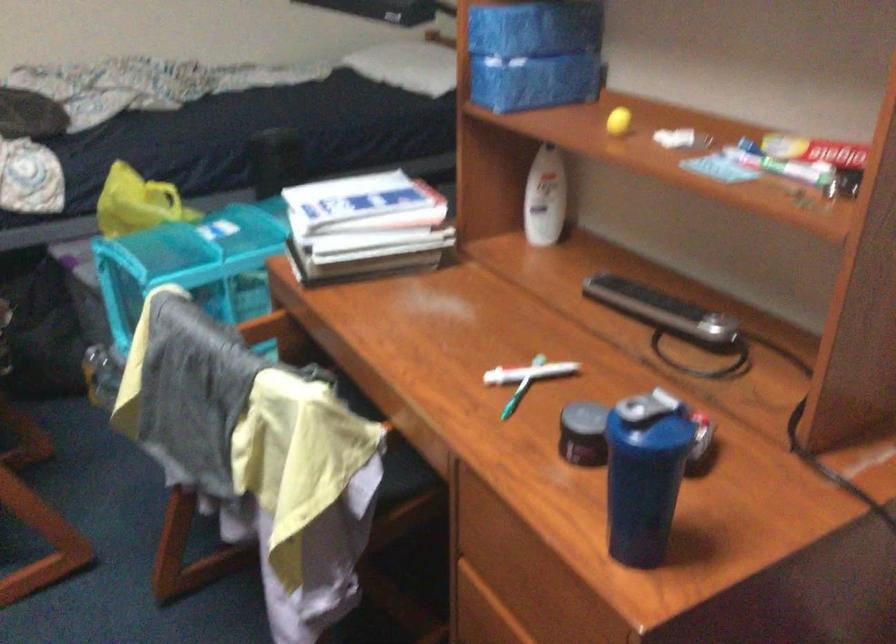
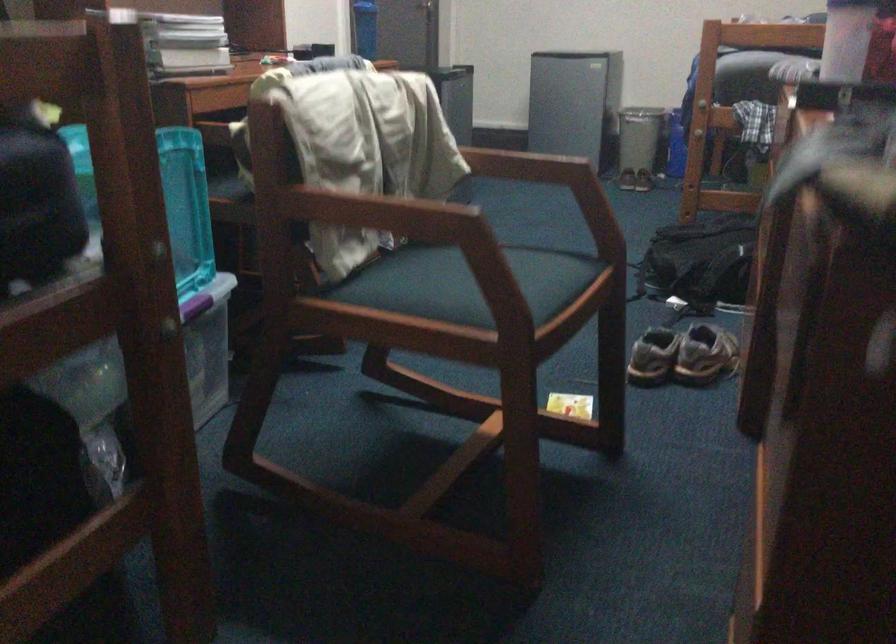
Question: I am providing you with two images of the same scene from different viewpoints. Which of the following objects are not visible in image2?

Choices:
 (A) cyan container lid
 (B) silver trash can
 (C) pair of brown shoes
 (D) white shaker bottle

Answer: (A)